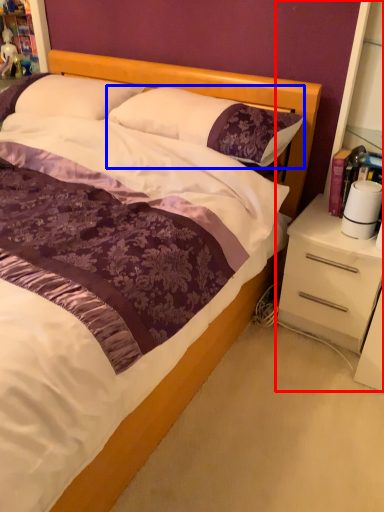
Question: Among these objects, which one is farthest to the camera, dresser (highlighted by a red box) or pillow (highlighted by a blue box)?

Choices:
 (A) dresser
 (B) pillow

Answer: (B)